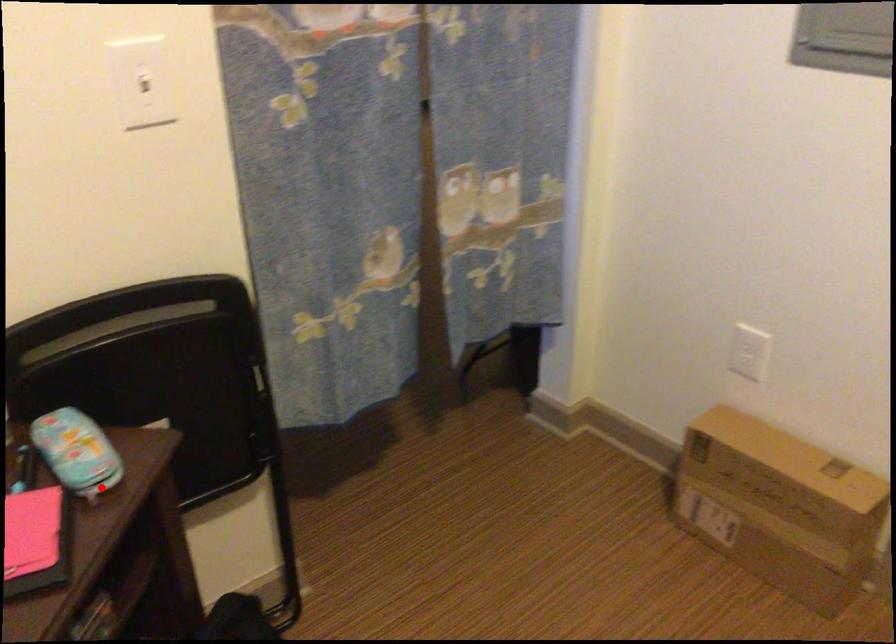
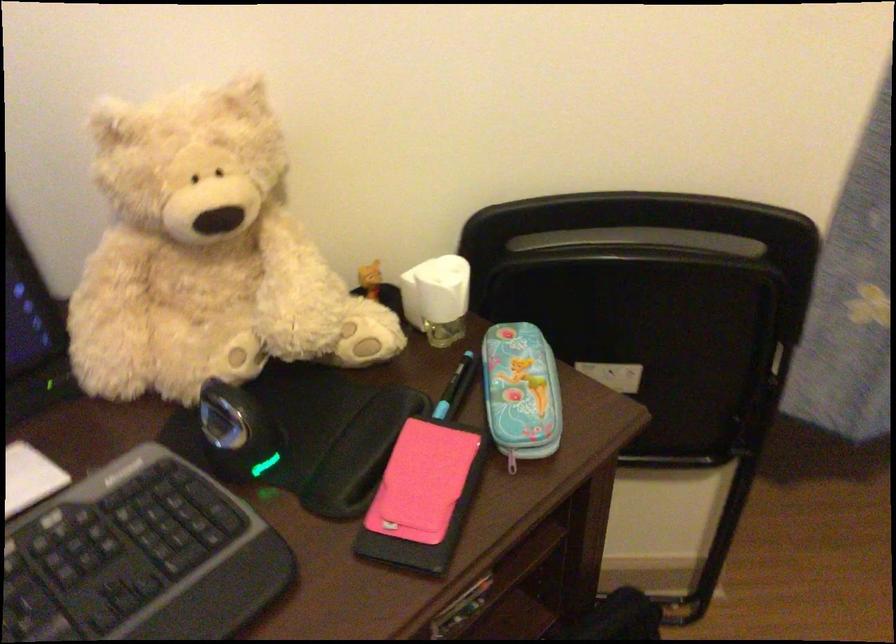
Question: I am providing you with two images of the same scene from different viewpoints. In image1, a red point is highlighted. Considering the same 3D point in image2, which of the following is correct?

Choices:
 (A) It is closer
 (B) It is farther

Answer: (A)